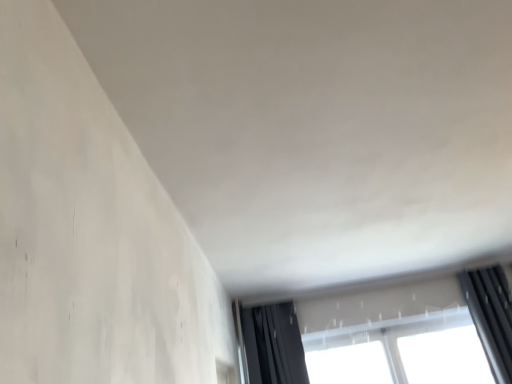
Describe the element at coordinates (383, 325) in the screenshot. I see `transparent glass window at lower right` at that location.

Where is `transparent glass window at lower right`? transparent glass window at lower right is located at coordinates pyautogui.click(x=383, y=325).

This screenshot has width=512, height=384. What are the coordinates of `black fabric curtain at upper right` in the screenshot? It's located at (488, 326).

Image resolution: width=512 pixels, height=384 pixels. What do you see at coordinates (488, 326) in the screenshot?
I see `black fabric curtain at upper right` at bounding box center [488, 326].

Measure the distance between point (497, 298) and camera.

Point (497, 298) and camera are 3.06 meters apart from each other.

Locate an element on the screen. transparent glass window at lower right is located at coordinates (383, 325).

Looking at this image, would you say black fabric curtain at upper right is to the left or to the right of transparent glass window at lower right in the picture?

black fabric curtain at upper right is positioned on transparent glass window at lower right's right side.

Which object is closer to the camera taking this photo, black fabric curtain at upper right or transparent glass window at lower right?

Positioned in front is black fabric curtain at upper right.

Which is behind, point (496, 356) or point (252, 320)?

Positioned behind is point (252, 320).

From the image's perspective, is black fabric curtain at upper right located above transparent glass window at lower right?

Incorrect, from the image's perspective, black fabric curtain at upper right is lower than transparent glass window at lower right.

From a real-world perspective, which object rests below the other?

black fabric curtain at upper right, from a real-world perspective.

Can you confirm if black fabric curtain at upper right is wider than transparent glass window at lower right?

Yes.

Considering the sizes of black fabric curtain at upper right and transparent glass window at lower right in the image, is black fabric curtain at upper right taller or shorter than transparent glass window at lower right?

Clearly, black fabric curtain at upper right is taller compared to transparent glass window at lower right.

Can you confirm if black fabric curtain at upper right is bigger than transparent glass window at lower right?

Yes, black fabric curtain at upper right is bigger than transparent glass window at lower right.

Is transparent glass window at lower right a part of black fabric curtain at upper right?

Actually, transparent glass window at lower right is outside black fabric curtain at upper right.

Are black fabric curtain at upper right and transparent glass window at lower right far apart?

No, black fabric curtain at upper right is not far from transparent glass window at lower right.

Is black fabric curtain at upper right oriented towards transparent glass window at lower right?

Yes, black fabric curtain at upper right is facing transparent glass window at lower right.

How many degrees apart are the facing directions of black fabric curtain at upper right and transparent glass window at lower right?

The facing directions of black fabric curtain at upper right and transparent glass window at lower right are 0.848 degrees apart.

How far apart are black fabric curtain at upper right and transparent glass window at lower right?

A distance of 14.79 inches exists between black fabric curtain at upper right and transparent glass window at lower right.

This screenshot has height=384, width=512. Identify the location of window above the black fabric curtain at upper right (from a real-world perspective). (383, 325).

Can you confirm if transparent glass window at lower right is positioned to the right of black fabric curtain at upper right?

No.

Is transparent glass window at lower right behind black fabric curtain at upper right?

Yes, it is.

Which is nearer, (252, 309) or (509, 370)?

Point (252, 309).

From the image's perspective, is transparent glass window at lower right located above or below black fabric curtain at upper right?

transparent glass window at lower right is above black fabric curtain at upper right.

From a real-world perspective, is transparent glass window at lower right above or below black fabric curtain at upper right?

transparent glass window at lower right is above black fabric curtain at upper right.

Which of these two, transparent glass window at lower right or black fabric curtain at upper right, is thinner?

transparent glass window at lower right is thinner.

From their relative heights in the image, would you say transparent glass window at lower right is taller or shorter than black fabric curtain at upper right?

In the image, transparent glass window at lower right appears to be shorter than black fabric curtain at upper right.

Who is smaller, transparent glass window at lower right or black fabric curtain at upper right?

Smaller between the two is transparent glass window at lower right.

Is transparent glass window at lower right spatially inside black fabric curtain at upper right, or outside of it?

transparent glass window at lower right exists outside the volume of black fabric curtain at upper right.

Are transparent glass window at lower right and black fabric curtain at upper right making contact?

No, transparent glass window at lower right is not beside black fabric curtain at upper right.

Is transparent glass window at lower right looking in the opposite direction of black fabric curtain at upper right?

Yes, transparent glass window at lower right's orientation is away from black fabric curtain at upper right.

Identify the location of curtain that appears below the transparent glass window at lower right (from a real-world perspective). This screenshot has height=384, width=512. (488, 326).

This screenshot has width=512, height=384. Identify the location of curtain in front of the transparent glass window at lower right. (488, 326).

This screenshot has height=384, width=512. What are the coordinates of `curtain on the right of the transparent glass window at lower right` in the screenshot? It's located at (488, 326).